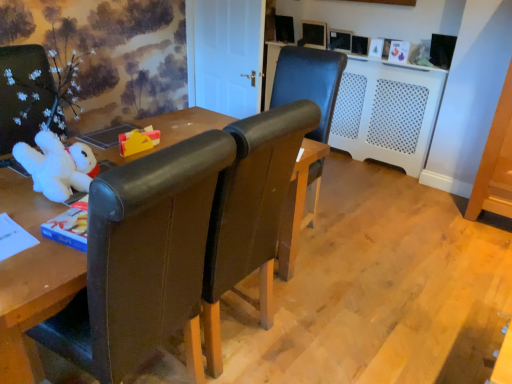
Question: Is point (60, 152) positioned closer to the camera than point (126, 139)?

Choices:
 (A) closer
 (B) farther

Answer: (A)

Question: From the image's perspective, is white plush toy at left, which is the second toy in back-to-front order, located above or below matte yellow toy at center, placed as the 2th toy when sorted from front to back?

Choices:
 (A) above
 (B) below

Answer: (B)

Question: Based on their relative distances, which object is nearer to the white plush toy at left, which is the second toy in back-to-front order?

Choices:
 (A) leather chair at left, positioned as the 1th chair in left-to-right order
 (B) leather chair at center, which ranks as the 2th chair in left-to-right order
 (C) white plastic radiator at center
 (D) matte yellow toy at center, arranged as the first toy when viewed from the back

Answer: (D)

Question: Estimate the real-world distances between objects in this image. Which object is closer to the matte yellow toy at center, placed as the 2th toy when sorted from front to back?

Choices:
 (A) leather chair at center, placed as the first chair when sorted from right to left
 (B) white plastic radiator at center
 (C) white plush toy at left, which is the second toy in back-to-front order
 (D) leather chair at left, positioned as the 1th chair in front-to-back order

Answer: (C)